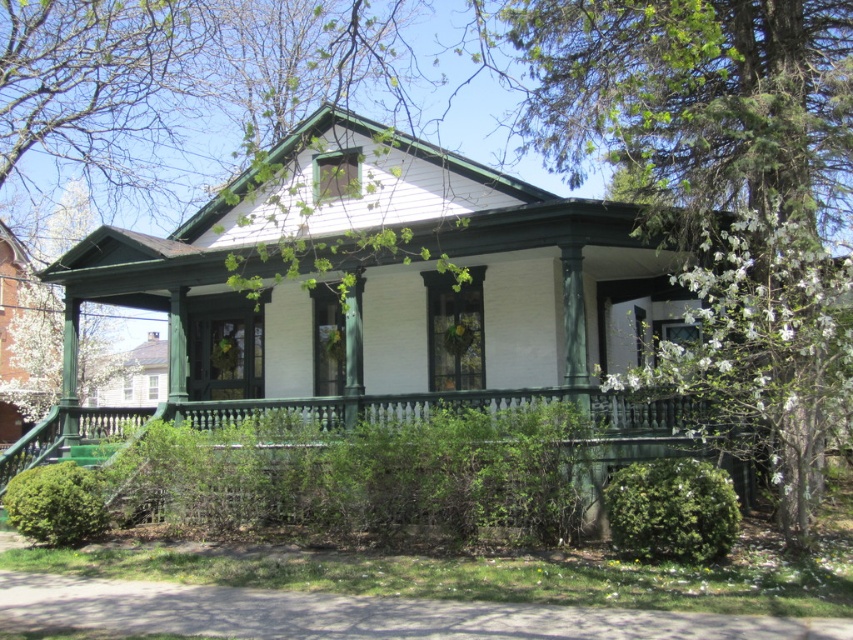
Between white blossoming tree at right and green painted wood porch at center, which one is positioned higher?

Positioned higher is white blossoming tree at right.

Can you confirm if white blossoming tree at right is positioned to the right of green painted wood porch at center?

Correct, you'll find white blossoming tree at right to the right of green painted wood porch at center.

Is point (791, 444) positioned before point (3, 474)?

Yes, point (791, 444) is in front of point (3, 474).

The image size is (853, 640). In order to click on white blossoming tree at right in this screenshot , I will do `click(764, 349)`.